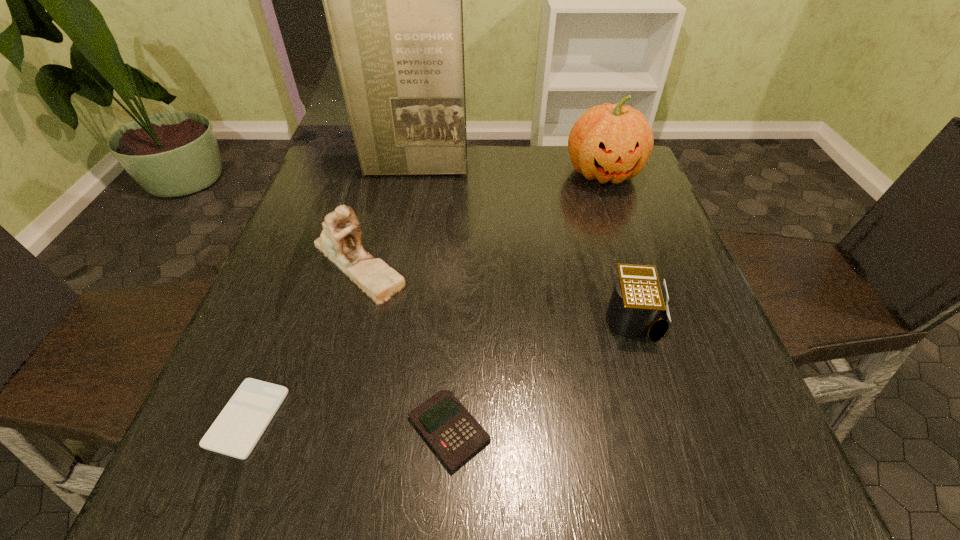
Point out which object is positioned as the fourth nearest to the tallest object. Please provide its 2D coordinates. Your answer should be formatted as a tuple, i.e. [(x, y)], where the tuple contains the x and y coordinates of a point satisfying the conditions above.

[(235, 432)]

Locate an element on the screen. This screenshot has width=960, height=540. object that is the fifth nearest to the shortest calculator is located at coordinates tap(608, 142).

Locate an element on the screen. calculator that stands as the closest to the shortest object is located at coordinates (455, 435).

At what (x,y) coordinates should I click in order to perform the action: click on calculator that is the second closest to the second tallest calculator. Please return your answer as a coordinate pair (x, y). The height and width of the screenshot is (540, 960). Looking at the image, I should click on (638, 306).

Find the location of a particular element. The image size is (960, 540). free space in the image that satisfies the following two spatial constraints: 1. on the cover of the second tallest calculator; 2. on the left side of the phonebook is located at coordinates (364, 431).

Image resolution: width=960 pixels, height=540 pixels. What are the coordinates of `vacant space that satisfies the following two spatial constraints: 1. on the cover of the tallest calculator; 2. on the left side of the phonebook` in the screenshot? It's located at (385, 319).

Where is `vacant region that satisfies the following two spatial constraints: 1. on the cover of the second shortest object; 2. on the left side of the tallest object`? vacant region that satisfies the following two spatial constraints: 1. on the cover of the second shortest object; 2. on the left side of the tallest object is located at coordinates (364, 431).

Identify the location of vacant space that satisfies the following two spatial constraints: 1. on the front-facing side of the fifth tallest object; 2. on the left side of the fourth shortest object. (312, 431).